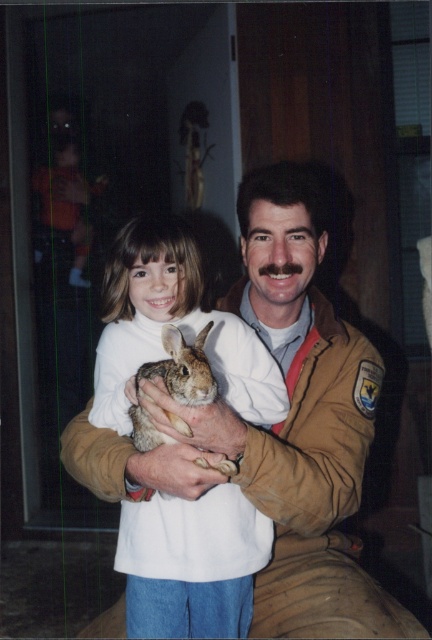
You are trying to decide whether the white soft turtleneck at center can fully cover the fuzzy brown rabbit at center if placed over it. Based on their sizes, is this possible?

The white soft turtleneck at center might be wider than fuzzy brown rabbit at center, so there is a possibility that it could cover the rabbit depending on the length and how it is arranged.

You are a delivery robot that is 1 meter tall. You are approaching the scene shown in the image. There is a white soft turtleneck at center in the scene. Can you safely pass under it without hitting your head?

The distance between the white soft turtleneck at center and the viewer is 1.18 meters. Since the robot is 1 meter tall, it can safely pass under the white soft turtleneck at center as there is enough clearance.